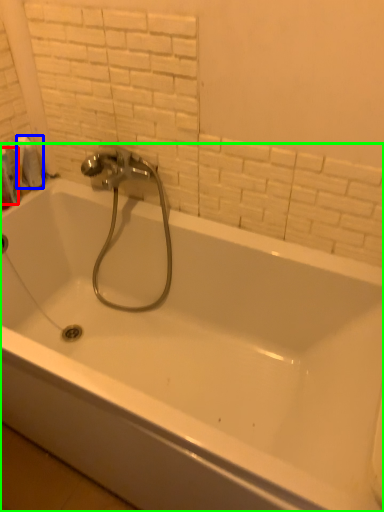
Question: Which object is the farthest from toiletry (highlighted by a red box)? Choose among these: toilet paper (highlighted by a blue box) or bathtub (highlighted by a green box).

Choices:
 (A) toilet paper
 (B) bathtub

Answer: (B)